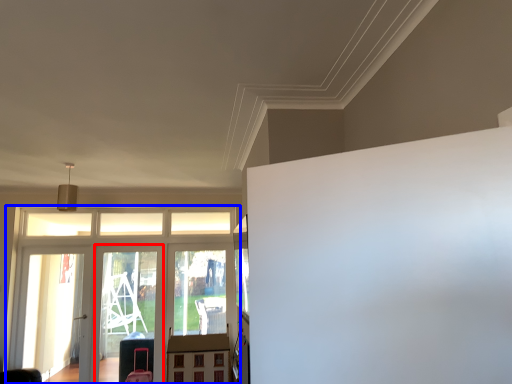
Question: Which point is further to the camera, screen door (highlighted by a red box) or elevator (highlighted by a blue box)?

Choices:
 (A) screen door
 (B) elevator

Answer: (A)